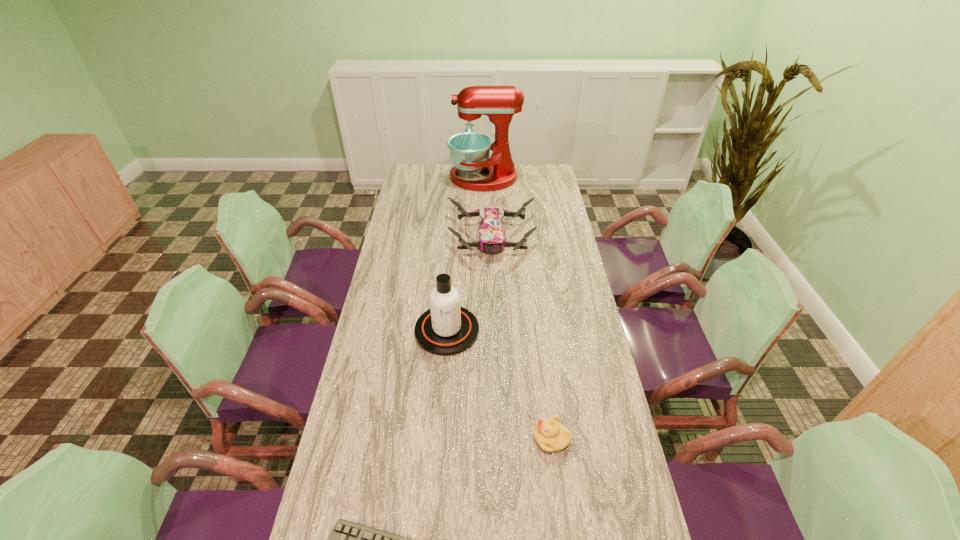
Identify the location of vacant space located 0.220m on the front-facing side of the tallest object. This screenshot has width=960, height=540. (407, 178).

Identify the location of vacant space located on the back of the cleansing agent. (450, 281).

This screenshot has height=540, width=960. I want to click on free location located on the front-facing side of the fourth nearest object, so click(494, 313).

At what (x,y) coordinates should I click in order to perform the action: click on vacant space located 0.210m at the face of the second shortest object. Please return your answer as a coordinate pair (x, y). The height and width of the screenshot is (540, 960). Looking at the image, I should click on (459, 438).

Identify the location of free space located at the face of the second shortest object. (392, 438).

You are a GUI agent. You are given a task and a screenshot of the screen. Output one action in this format:
    pyautogui.click(x=<x>, y=<y>)
    Task: Click on the vacant space located 0.080m at the face of the second shortest object
    
    Given the screenshot: What is the action you would take?
    pyautogui.click(x=505, y=438)

You are a GUI agent. You are given a task and a screenshot of the screen. Output one action in this format:
    pyautogui.click(x=<x>, y=<y>)
    Task: Click on the object at the far edge
    This screenshot has width=960, height=540.
    Given the screenshot: What is the action you would take?
    pyautogui.click(x=469, y=151)

What are the coordinates of `drone that is at the right edge` in the screenshot? It's located at (492, 235).

Locate an element on the screen. The image size is (960, 540). duckling that is at the right edge is located at coordinates (550, 435).

The image size is (960, 540). In the image, there is a desktop. What are the coordinates of `vacant space at the left edge` in the screenshot? It's located at (388, 256).